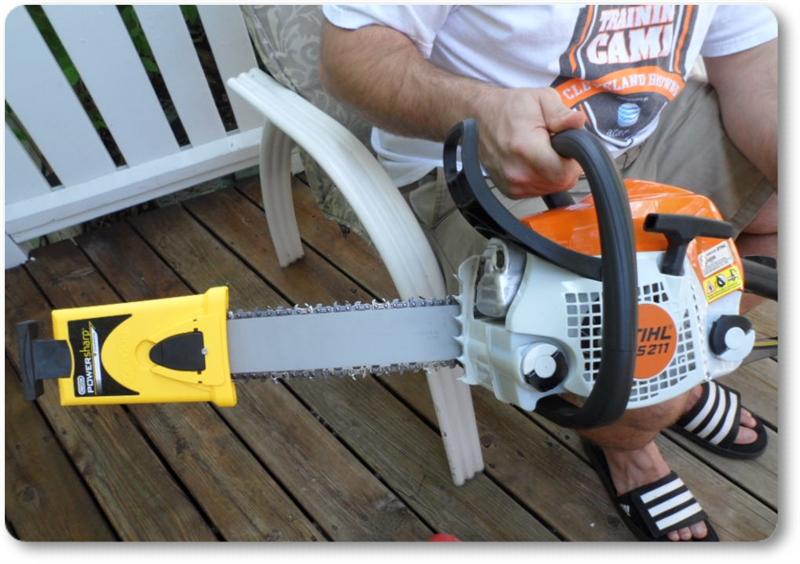
Where is `wooden floor`? wooden floor is located at coordinates (310, 477).